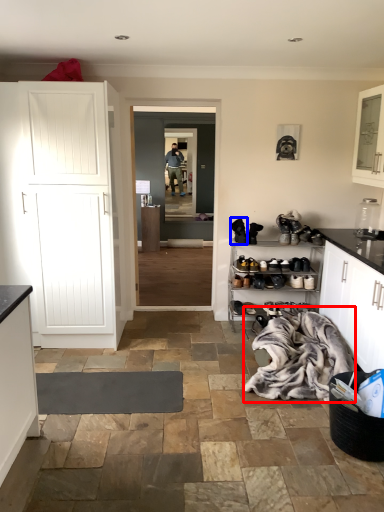
Question: Which of the following is the closest to the observer, laundry (highlighted by a red box) or footwear (highlighted by a blue box)?

Choices:
 (A) laundry
 (B) footwear

Answer: (A)